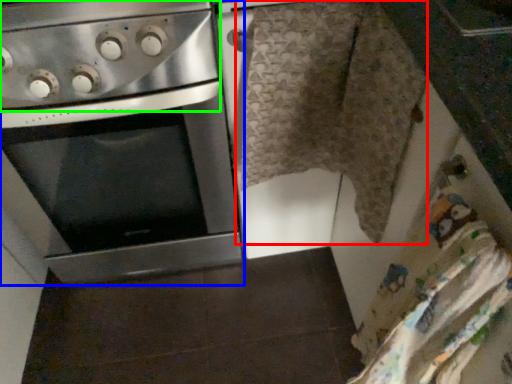
Question: Considering the real-world distances, which object is closest to blanket (highlighted by a red box)? oven (highlighted by a blue box) or gas stove (highlighted by a green box).

Choices:
 (A) oven
 (B) gas stove

Answer: (B)